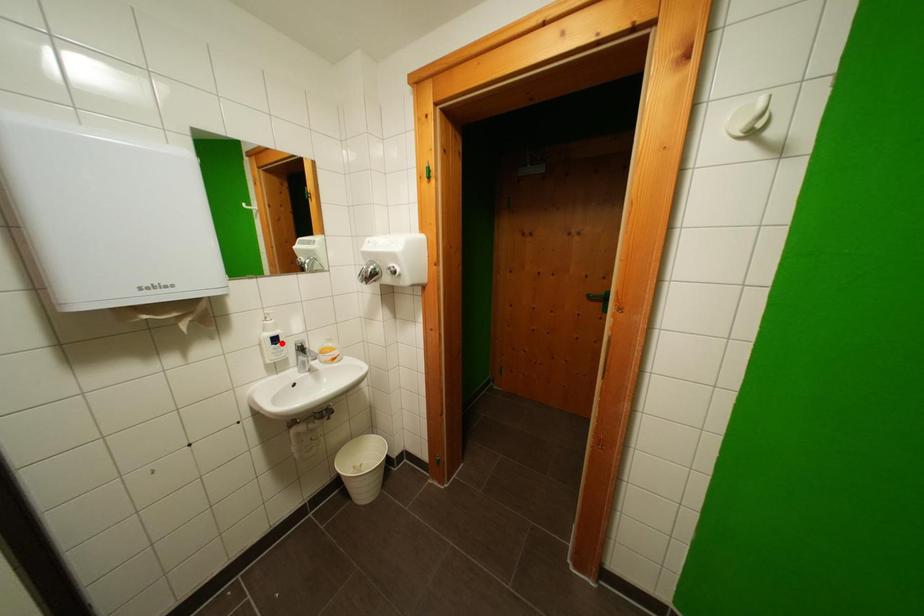
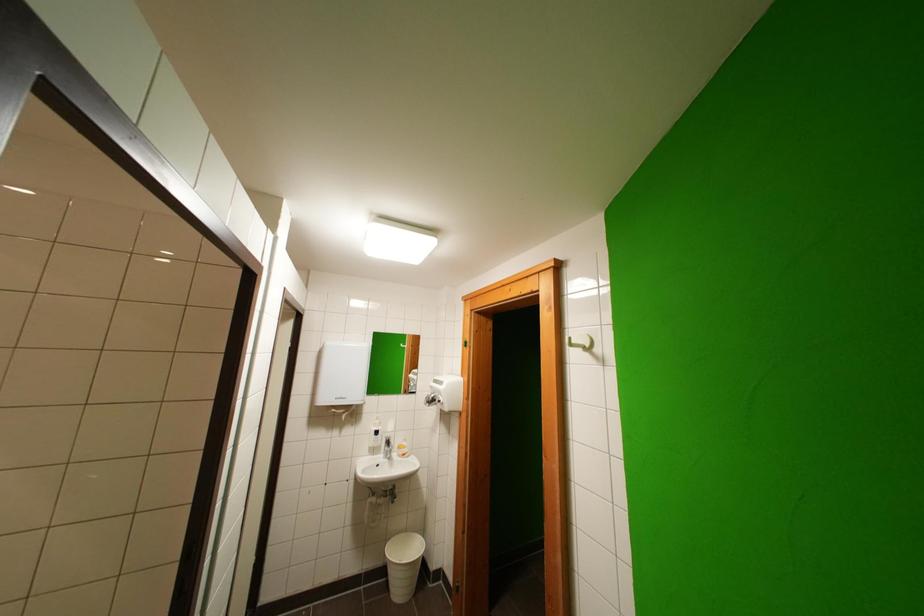
Question: I am providing you with two images of the same scene from different viewpoints. A red point is shown in image1. For the corresponding object point in image2, is it positioned nearer or farther from the camera?

Choices:
 (A) Nearer
 (B) Farther

Answer: (B)